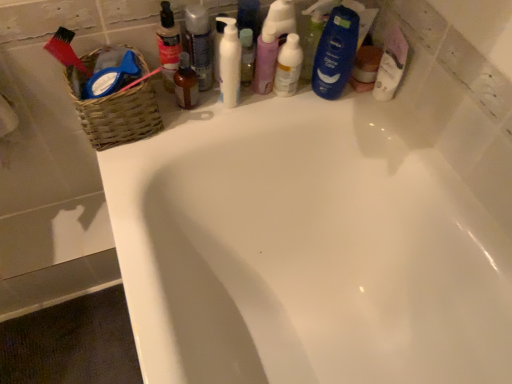
Find the location of a particular element. This screenshot has height=384, width=512. vacant area that is in front of woven brown basket at upper left is located at coordinates (126, 170).